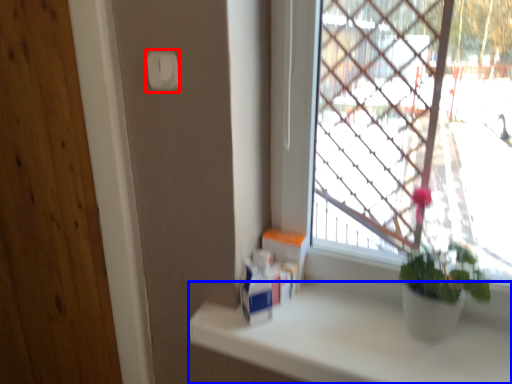
Question: Which object is closer to the camera taking this photo, light switch (highlighted by a red box) or counter top (highlighted by a blue box)?

Choices:
 (A) light switch
 (B) counter top

Answer: (B)